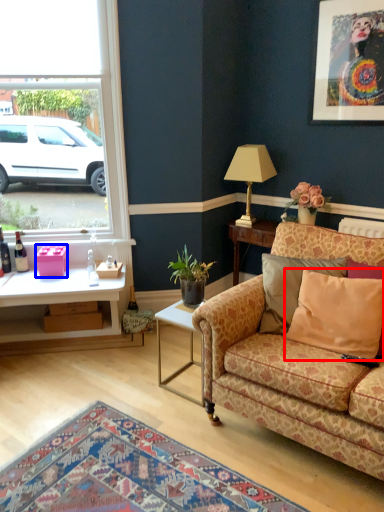
Question: Which object appears closest to the camera in this image, pillow (highlighted by a red box) or box (highlighted by a blue box)?

Choices:
 (A) pillow
 (B) box

Answer: (A)